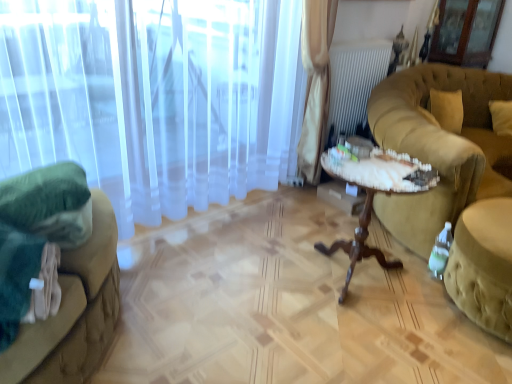
Identify the location of vacant space in front of woodenwoodentable at right. Image resolution: width=512 pixels, height=384 pixels. (367, 343).